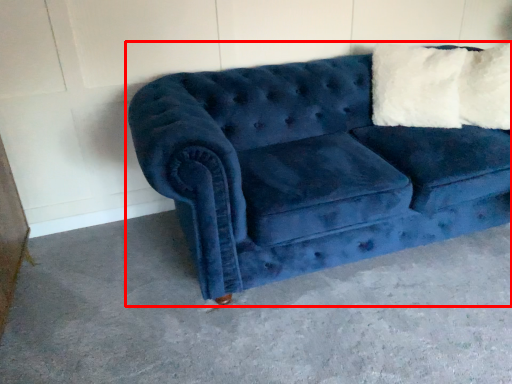
Question: Where is studio couch (annotated by the red box) located in relation to concrete in the image?

Choices:
 (A) left
 (B) right

Answer: (B)